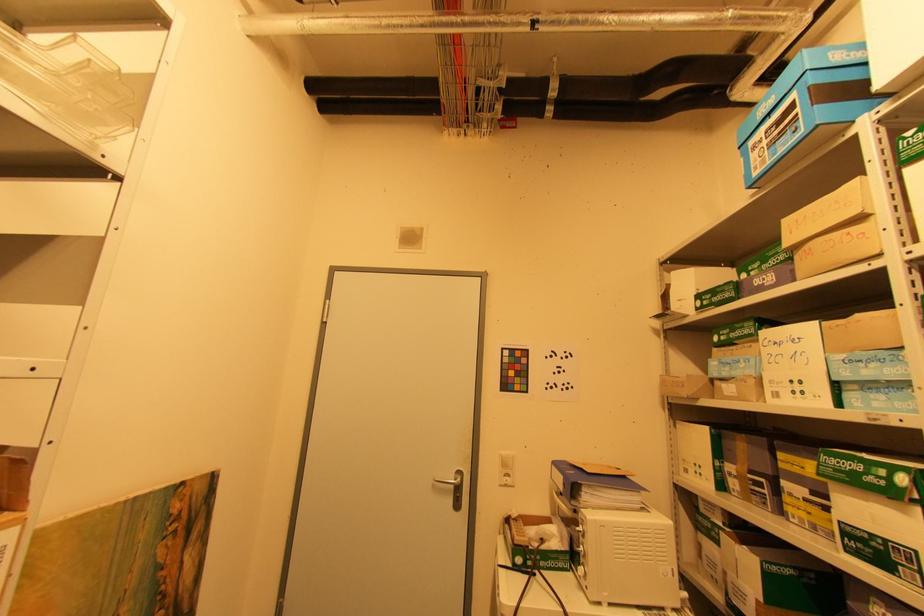
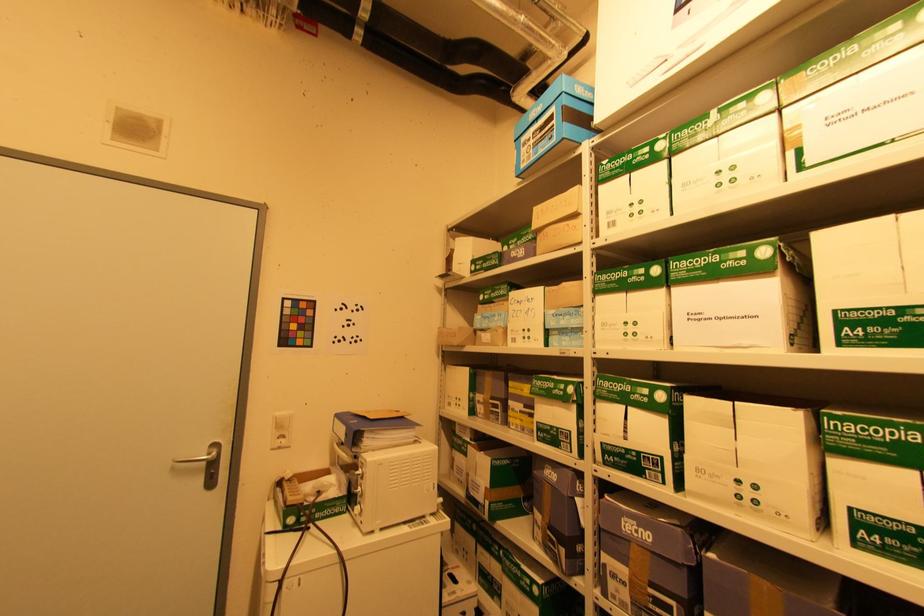
Question: How did the camera likely rotate?

Choices:
 (A) Left
 (B) Right
 (C) Up
 (D) Down

Answer: (B)